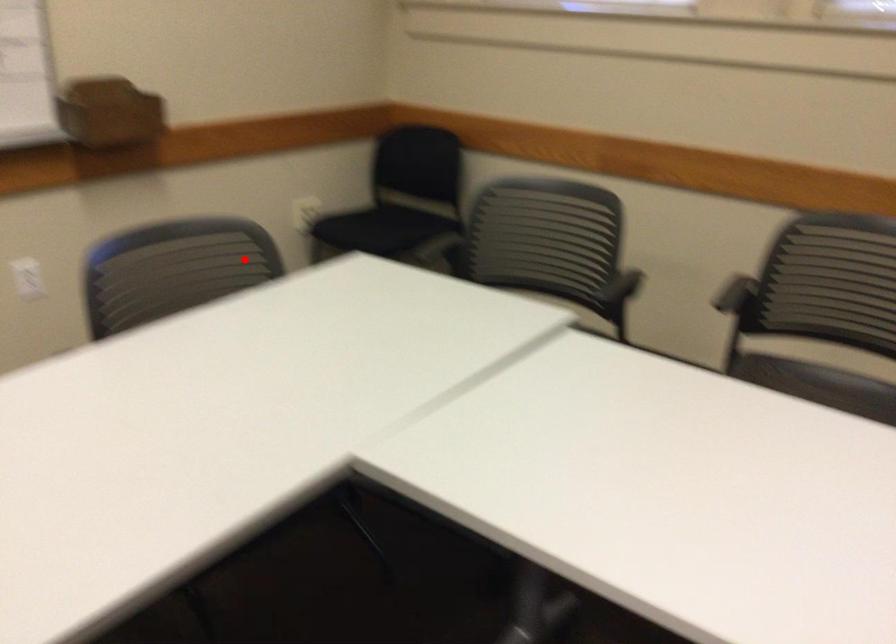
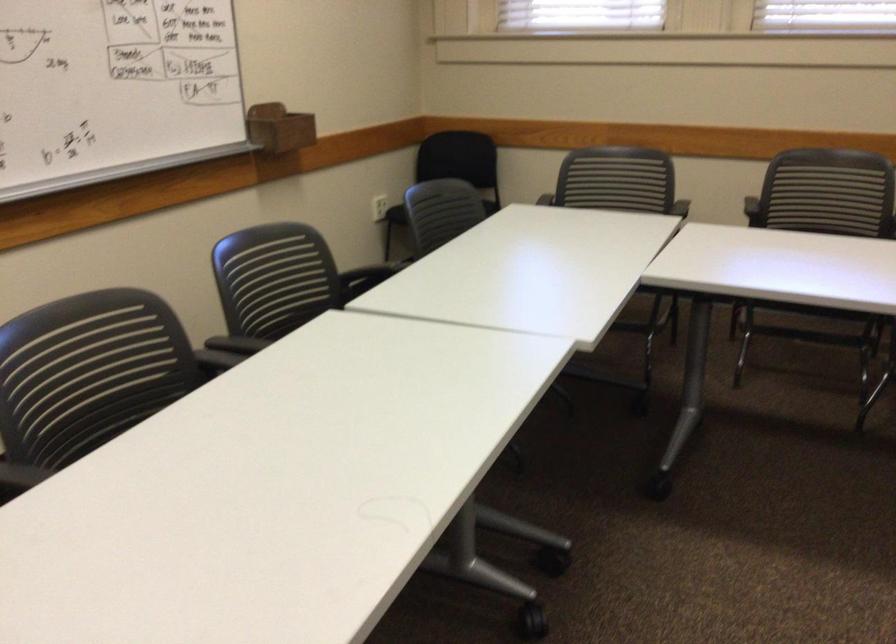
Question: I am providing you with two images of the same scene from different viewpoints. In image1, a red point is highlighted. Considering the same 3D point in image2, which of the following is correct?

Choices:
 (A) It is closer
 (B) It is farther

Answer: (B)